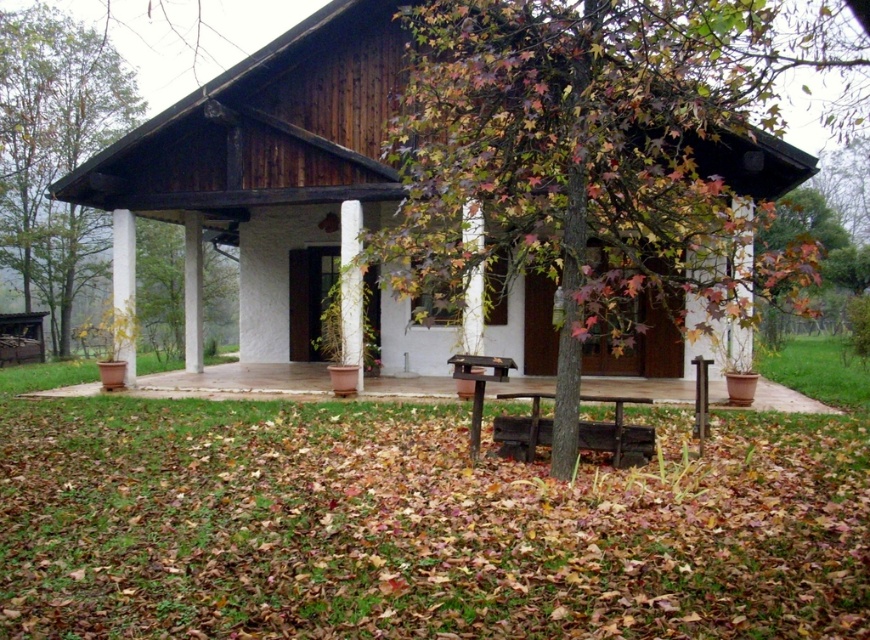
Question: Among these objects, which one is nearest to the camera?

Choices:
 (A) smooth concrete porch at center
 (B) dark brown wooden picnic table at center

Answer: (B)

Question: Is green leafy tree at left to the right of brown wooden park bench at center from the viewer's perspective?

Choices:
 (A) no
 (B) yes

Answer: (A)

Question: Considering the real-world distances, which object is closest to the brown wooden park bench at center?

Choices:
 (A) smooth concrete porch at center
 (B) wooden cabin at center
 (C) green leafy tree at left

Answer: (A)

Question: Is wooden cabin at center wider than brown wooden park bench at center?

Choices:
 (A) no
 (B) yes

Answer: (B)

Question: Which point is farther from the camera taking this photo?

Choices:
 (A) (17, 236)
 (B) (290, 42)

Answer: (A)

Question: From the image, what is the correct spatial relationship of wooden cabin at center in relation to brown wooden park bench at center?

Choices:
 (A) above
 (B) below

Answer: (A)